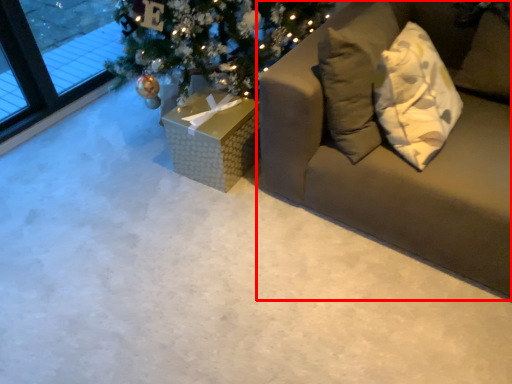
Question: From the image's perspective, where is studio couch (annotated by the red box) located in relation to furniture in the image?

Choices:
 (A) below
 (B) above

Answer: (B)